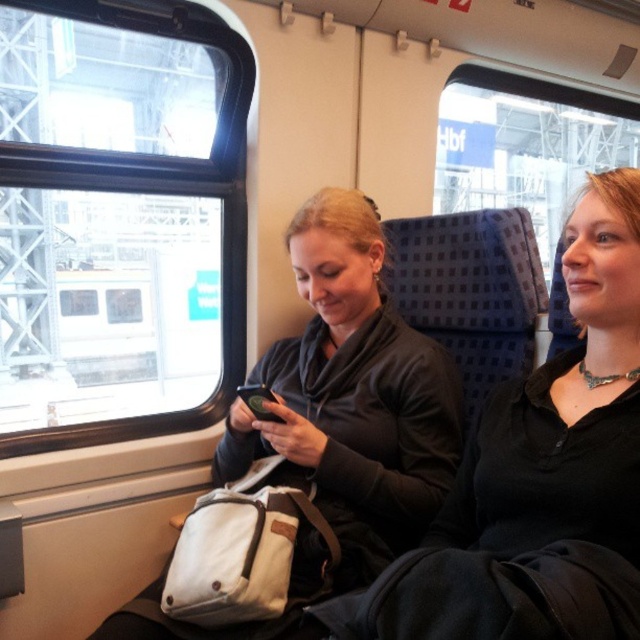
Can you confirm if transparent glass window at upper left is thinner than matte black jacket at center?

In fact, transparent glass window at upper left might be wider than matte black jacket at center.

Is point (168, 212) farther from camera compared to point (353, 509)?

Yes, it is behind point (353, 509).

Where is `transparent glass window at upper left`? Image resolution: width=640 pixels, height=640 pixels. transparent glass window at upper left is located at coordinates (120, 220).

This screenshot has width=640, height=640. What do you see at coordinates (540, 476) in the screenshot? I see `black matte jacket at center` at bounding box center [540, 476].

Locate an element on the screen. Image resolution: width=640 pixels, height=640 pixels. black matte jacket at center is located at coordinates (540, 476).

Does point (291, 224) come behind point (262, 410)?

Yes.

Where is `matte black jacket at center`? This screenshot has width=640, height=640. matte black jacket at center is located at coordinates (353, 396).

Identify the location of matte black jacket at center. (353, 396).